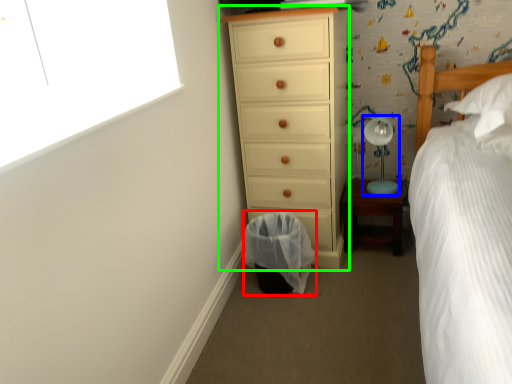
Question: Estimate the real-world distances between objects in this image. Which object is farther from laundry basket (highlighted by a red box), table lamp (highlighted by a blue box) or chest of drawers (highlighted by a green box)?

Choices:
 (A) table lamp
 (B) chest of drawers

Answer: (A)